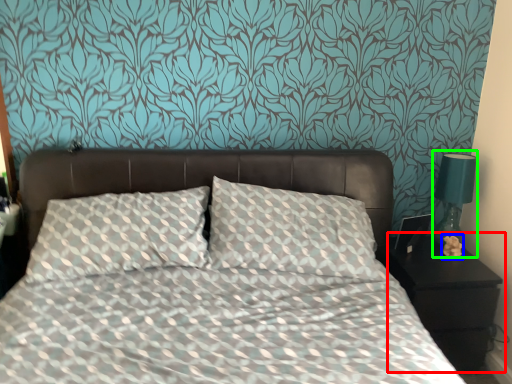
Question: Based on their relative distances, which object is nearer to nightstand (highlighted by a red box)? Choose from flower (highlighted by a blue box) and bedside lamp (highlighted by a green box).

Choices:
 (A) flower
 (B) bedside lamp

Answer: (A)